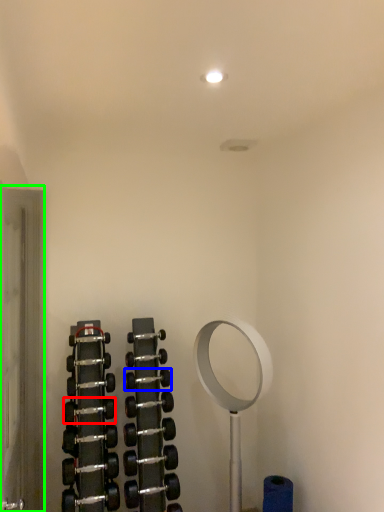
Question: Based on their relative distances, which object is farther from dumbbell (highlighted by a red box)? Choose from dumbbell (highlighted by a blue box) and glass door (highlighted by a green box).

Choices:
 (A) dumbbell
 (B) glass door

Answer: (B)